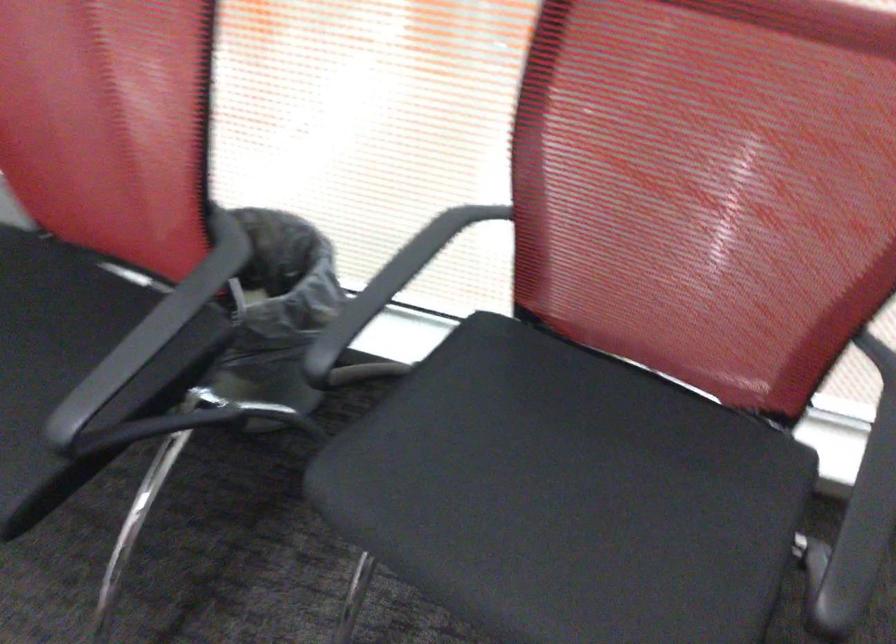
Based on the continuous images, in which direction is the camera rotating?

The camera rotated toward right-down.